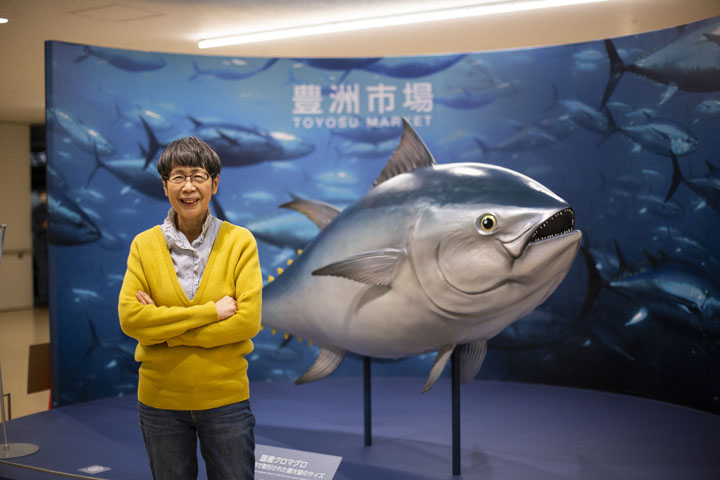
Identify the location of wall decorated with fishes. (255, 134), (652, 159), (660, 299).